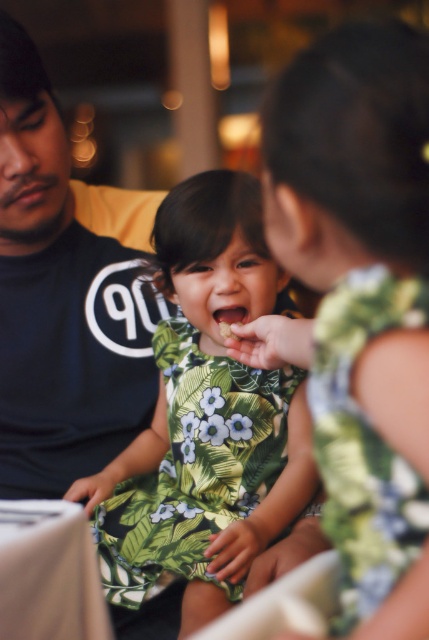
Question: Is the position of green leafy dress at center more distant than that of black cotton shirt at left?

Choices:
 (A) no
 (B) yes

Answer: (A)

Question: Can you confirm if black cotton shirt at left is positioned to the left of green floral fabric dress at center?

Choices:
 (A) no
 (B) yes

Answer: (B)

Question: Which point is closer to the camera taking this photo?

Choices:
 (A) (307, 445)
 (B) (326, 355)
 (C) (157, 387)

Answer: (B)

Question: Based on their relative distances, which object is nearer to the green floral fabric dress at center?

Choices:
 (A) black cotton shirt at left
 (B) green leafy dress at center

Answer: (B)

Question: Can you confirm if black cotton shirt at left is thinner than green floral fabric dress at center?

Choices:
 (A) yes
 (B) no

Answer: (B)

Question: Among these points, which one is nearest to the camera?

Choices:
 (A) (142, 312)
 (B) (390, 461)
 (C) (265, 454)

Answer: (B)